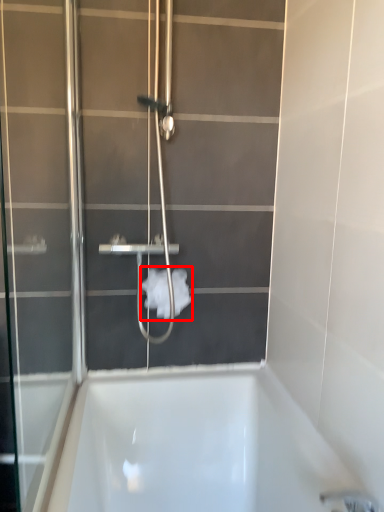
Question: From the image's perspective, what is the correct spatial positioning of toilet paper (annotated by the red box) in reference to screen door?

Choices:
 (A) above
 (B) below

Answer: (B)